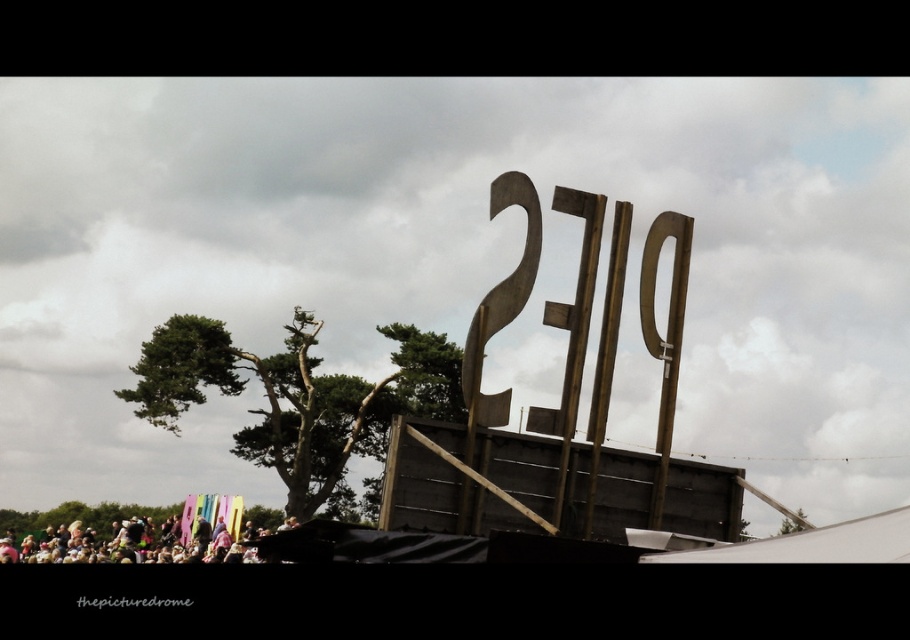
Locate an element on the screen. The image size is (910, 640). green textured tree at center is located at coordinates (297, 397).

Is green textured tree at center positioned before multicolored fabric at lower left?

That is True.

Is point (228, 333) farther from camera compared to point (15, 531)?

No, (228, 333) is closer to viewer.

Where is `green textured tree at center`? The image size is (910, 640). green textured tree at center is located at coordinates pyautogui.click(x=297, y=397).